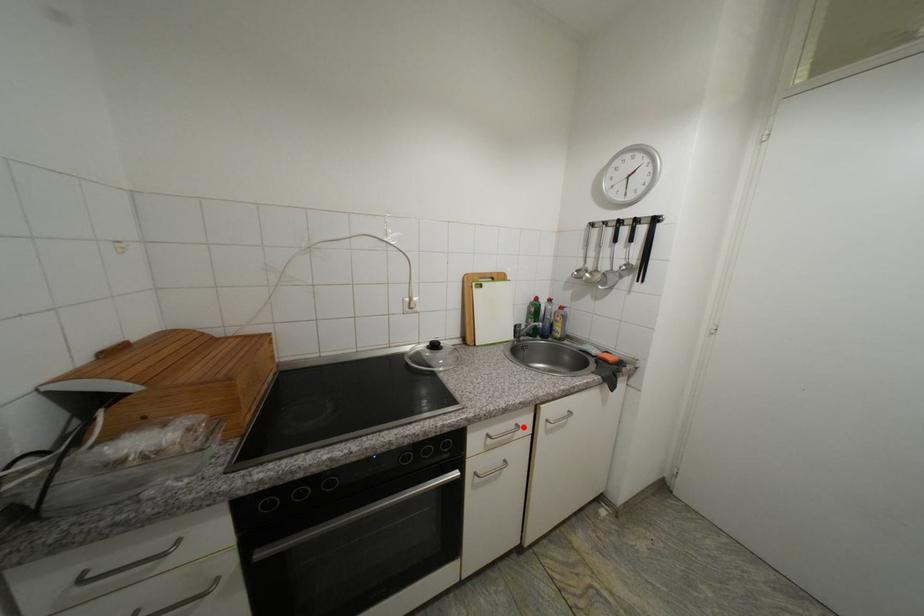
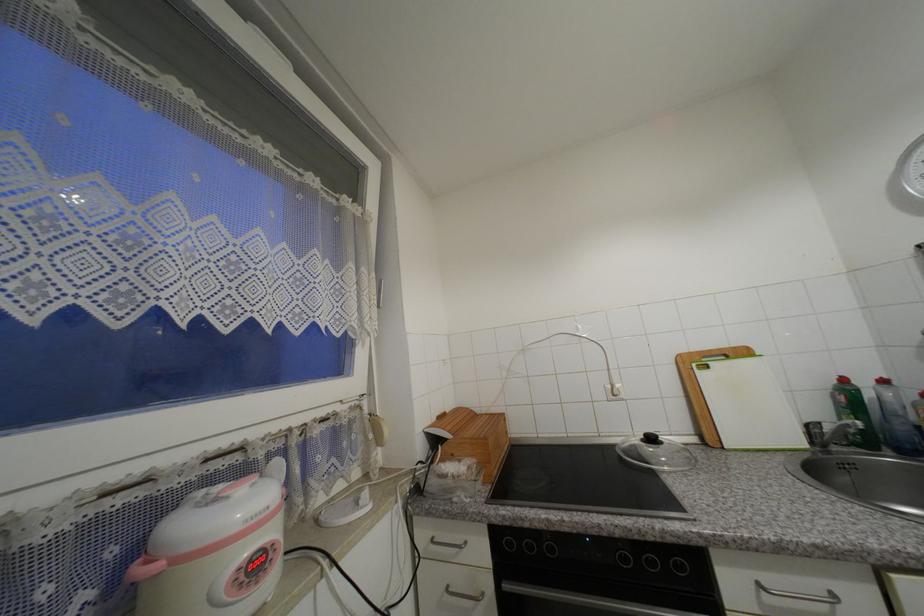
Question: I am providing you with two images of the same scene from different viewpoints. In image1, a red point is highlighted. Considering the same 3D point in image2, which of the following is correct?

Choices:
 (A) It is closer
 (B) It is farther

Answer: (A)